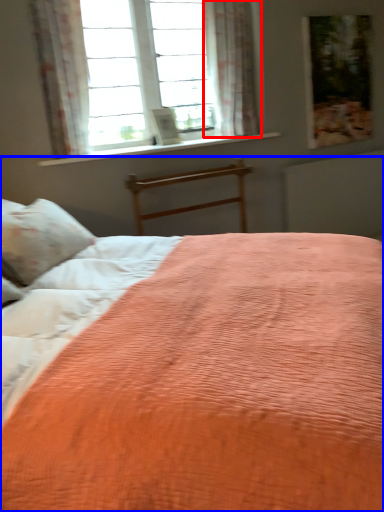
Question: Among these objects, which one is nearest to the camera, curtain (highlighted by a red box) or bed (highlighted by a blue box)?

Choices:
 (A) curtain
 (B) bed

Answer: (B)